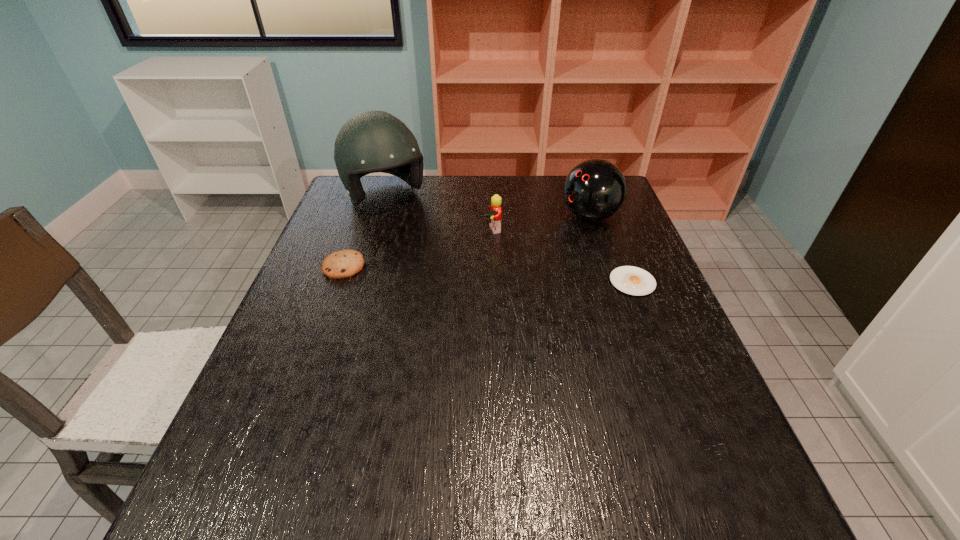
Find the location of `object that stands as the second closest to the second tallest object`. object that stands as the second closest to the second tallest object is located at coordinates (494, 214).

Where is `free space that satisfies the following two spatial constraints: 1. on the back side of the football helmet; 2. on the left side of the fourth tallest object`? free space that satisfies the following two spatial constraints: 1. on the back side of the football helmet; 2. on the left side of the fourth tallest object is located at coordinates (369, 198).

Identify the location of blank area in the image that satisfies the following two spatial constraints: 1. on the back side of the tallest object; 2. on the left side of the second shortest object. (369, 198).

The height and width of the screenshot is (540, 960). In order to click on vacant space that satisfies the following two spatial constraints: 1. on the front side of the football helmet; 2. on the left side of the second tallest object in this screenshot , I will do `click(379, 217)`.